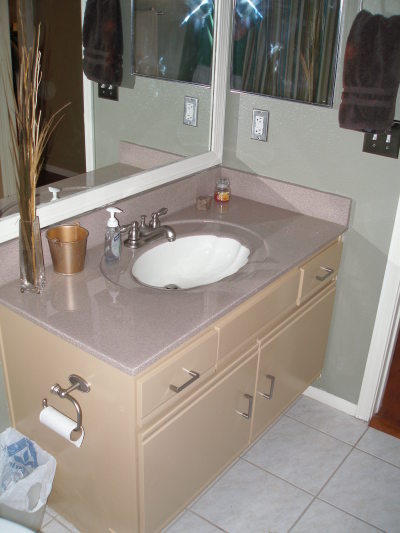
Where is `candle in jar`? candle in jar is located at coordinates (220, 191).